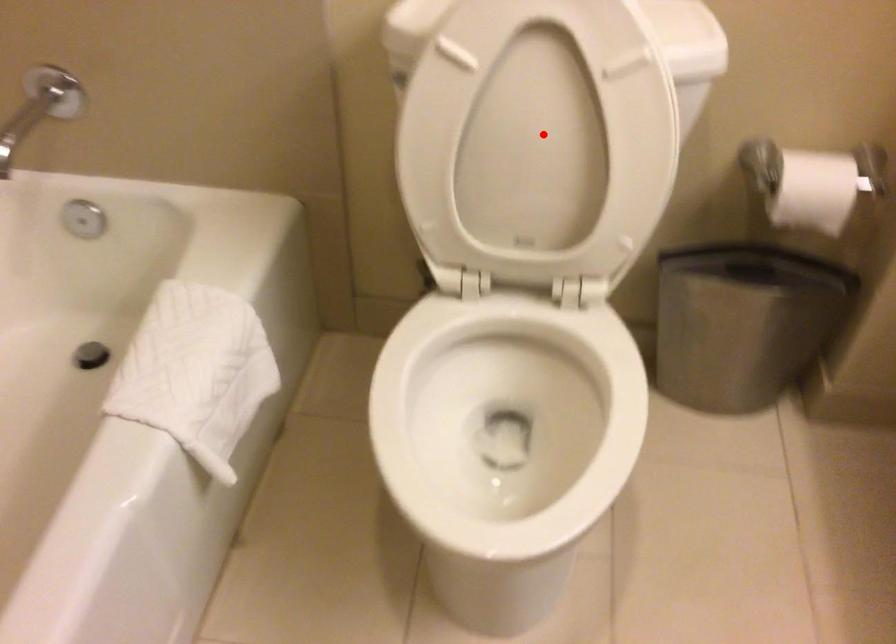
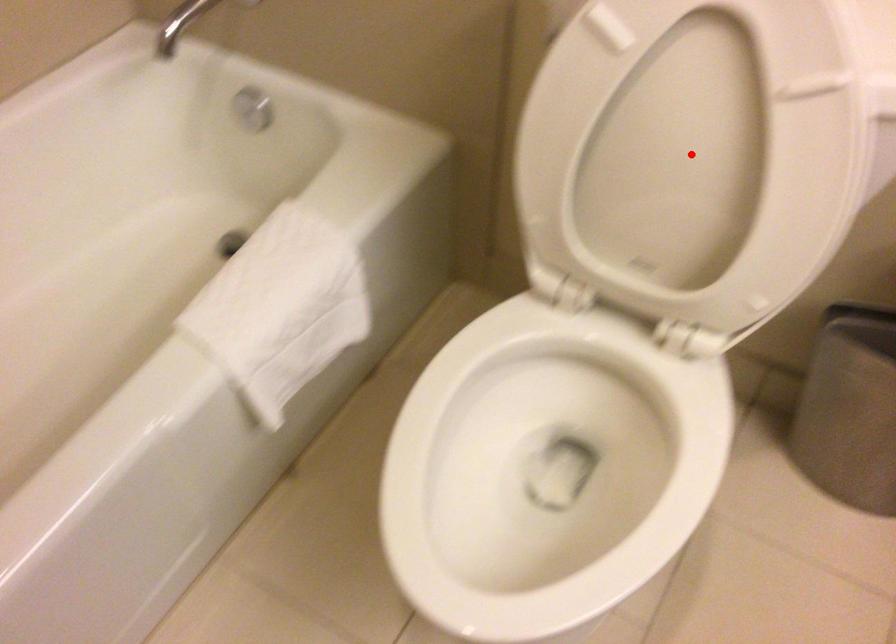
I am providing you with two images of the same scene from different viewpoints. A red point is marked on the first image and another point is marked on the second image. Is the red point in image1 aligned with the point shown in image2?

Yes